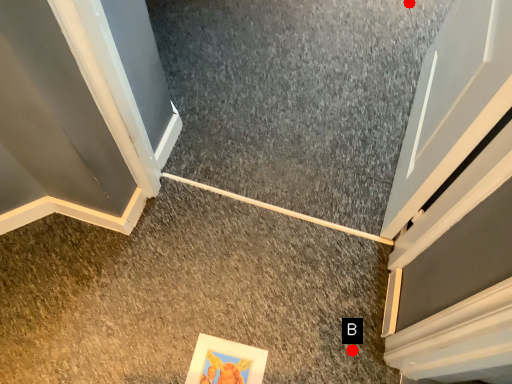
Question: Two points are circled on the image, labeled by A and B beside each circle. Which point is farther from the camera taking this photo?

Choices:
 (A) A is further
 (B) B is further

Answer: (A)